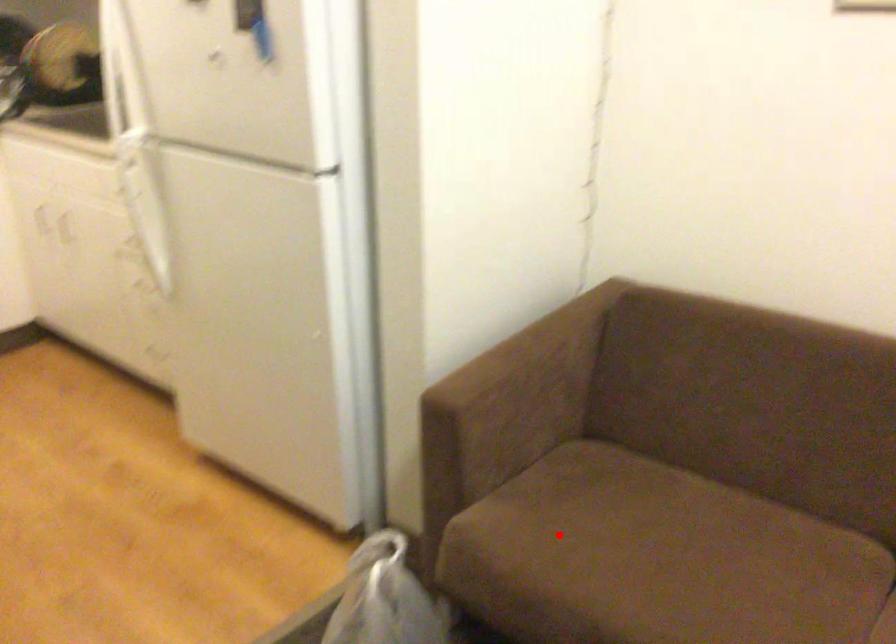
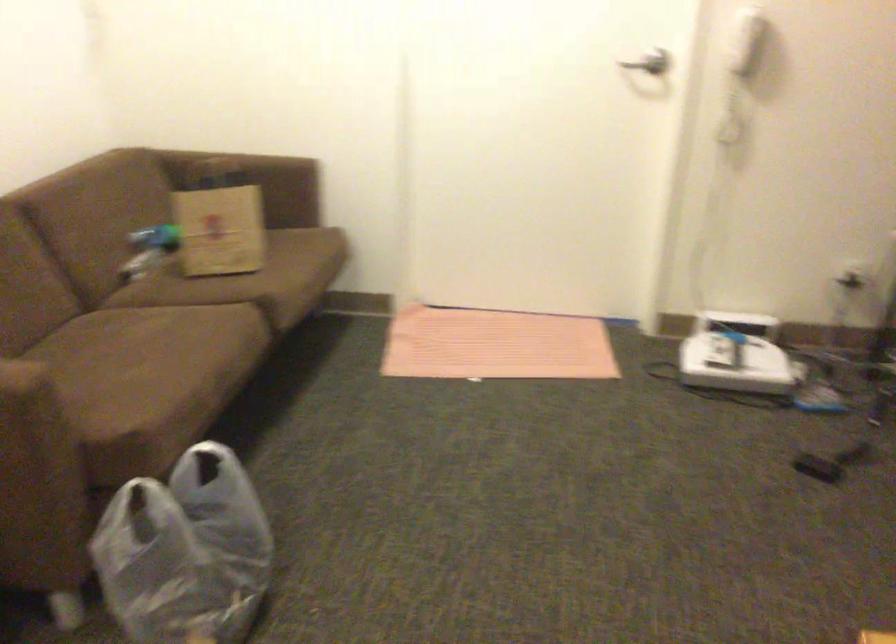
Question: I am providing you with two images of the same scene from different viewpoints. A red point is shown in image1. For the corresponding object point in image2, is it positioned nearer or farther from the camera?

Choices:
 (A) Nearer
 (B) Farther

Answer: (B)